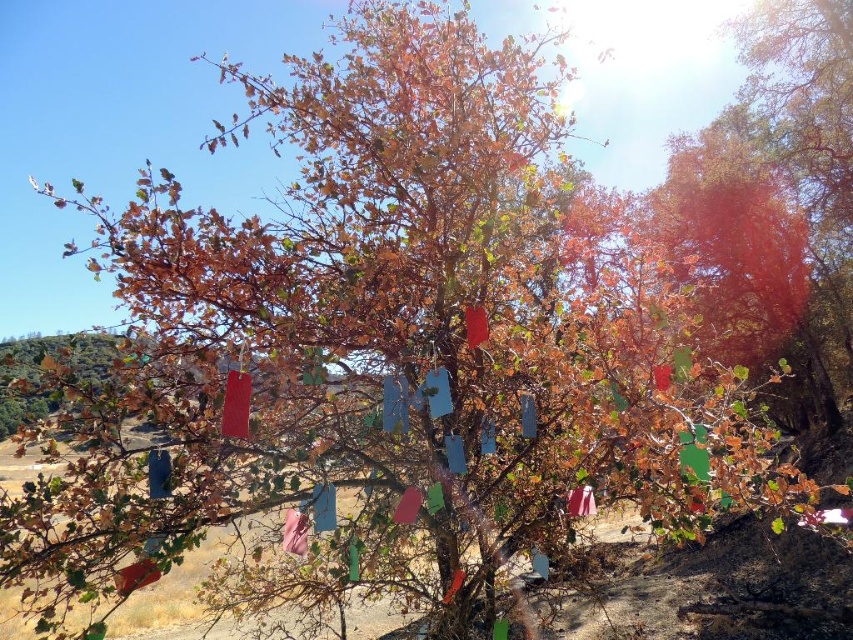
Question: Which of the following is the closest to the observer?

Choices:
 (A) matte red flag at center
 (B) red matte flag at center
 (C) matte red flag at lower left

Answer: (A)

Question: Which of the following is the farthest from the observer?

Choices:
 (A) matte red flag at center
 (B) matte red flag at lower left
 (C) pink fabric flag at center
 (D) red matte flag at center

Answer: (C)

Question: Which point is closer to the camera?

Choices:
 (A) red matte flag at center
 (B) pink fabric flag at center

Answer: (A)

Question: Is matte red flag at lower left closer to the viewer compared to red matte flag at center?

Choices:
 (A) yes
 (B) no

Answer: (A)

Question: Is matte red flag at lower left above pink fabric flag at center?

Choices:
 (A) no
 (B) yes

Answer: (A)

Question: Can you confirm if matte red flag at center is wider than pink fabric flag at center?

Choices:
 (A) no
 (B) yes

Answer: (A)